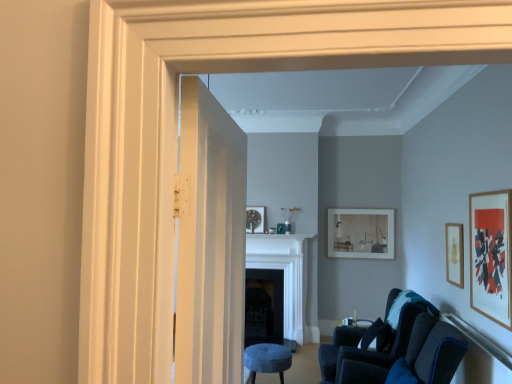
Find the location of a particular element. This screenshot has height=384, width=512. vacant area on top of matte white picture frame at center-right, which appears as the 3th picture frame when viewed from the front (from a real-world perspective) is located at coordinates coord(350,210).